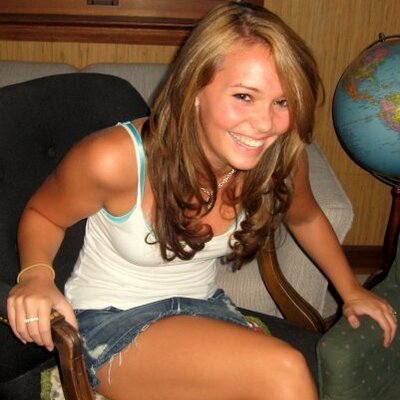
Locate an element on the screen. green chair is located at coordinates (352, 360).